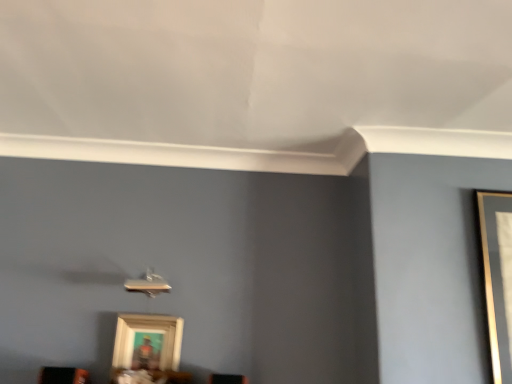
What do you see at coordinates (63, 375) in the screenshot? This screenshot has width=512, height=384. I see `matte black speaker at lower left` at bounding box center [63, 375].

Where is `matte black speaker at lower left`? matte black speaker at lower left is located at coordinates (63, 375).

This screenshot has height=384, width=512. Describe the element at coordinates (147, 349) in the screenshot. I see `wooden framed picture at lower center` at that location.

The image size is (512, 384). I want to click on wooden framed picture at lower center, so [147, 349].

The height and width of the screenshot is (384, 512). Identify the location of matte black speaker at lower left. (63, 375).

Can you confirm if matte black speaker at lower left is positioned to the right of wooden framed picture at lower center?

In fact, matte black speaker at lower left is to the left of wooden framed picture at lower center.

Considering their positions, is matte black speaker at lower left located in front of or behind wooden framed picture at lower center?

Visually, matte black speaker at lower left is located in front of wooden framed picture at lower center.

Considering the positions of point (73, 369) and point (122, 321), is point (73, 369) closer or farther from the camera than point (122, 321)?

Point (73, 369) is positioned closer to the camera compared to point (122, 321).

From the image's perspective, which object appears higher, matte black speaker at lower left or wooden framed picture at lower center?

wooden framed picture at lower center appears higher in the image.

From a real-world perspective, is matte black speaker at lower left above or below wooden framed picture at lower center?

In terms of real-world spatial position, matte black speaker at lower left is below wooden framed picture at lower center.

Looking at their sizes, would you say matte black speaker at lower left is wider or thinner than wooden framed picture at lower center?

In the image, matte black speaker at lower left appears to be wider than wooden framed picture at lower center.

Can you confirm if matte black speaker at lower left is shorter than wooden framed picture at lower center?

Yes.

Is matte black speaker at lower left smaller than wooden framed picture at lower center?

Yes, matte black speaker at lower left is smaller than wooden framed picture at lower center.

Is matte black speaker at lower left positioned beyond the bounds of wooden framed picture at lower center?

Yes, matte black speaker at lower left is outside of wooden framed picture at lower center.

Is matte black speaker at lower left not near wooden framed picture at lower center?

No, matte black speaker at lower left is not far away from wooden framed picture at lower center.

Is matte black speaker at lower left looking in the opposite direction of wooden framed picture at lower center?

matte black speaker at lower left is not turned away from wooden framed picture at lower center.

In order to click on picture frame above the matte black speaker at lower left (from a real-world perspective) in this screenshot , I will do `click(147, 349)`.

Would you say wooden framed picture at lower center is to the left or to the right of matte black speaker at lower left in the picture?

Based on their positions, wooden framed picture at lower center is located to the right of matte black speaker at lower left.

Is wooden framed picture at lower center further to the viewer compared to matte black speaker at lower left?

Yes, it is.

Is point (146, 346) positioned before point (68, 382)?

That is False.

From the image's perspective, is wooden framed picture at lower center positioned above or below matte black speaker at lower left?

From the image's perspective, wooden framed picture at lower center appears above matte black speaker at lower left.

From a real-world perspective, which object stands above the other?

In real-world perspective, wooden framed picture at lower center is above.

Considering the relative sizes of wooden framed picture at lower center and matte black speaker at lower left in the image provided, is wooden framed picture at lower center wider than matte black speaker at lower left?

Incorrect, the width of wooden framed picture at lower center does not surpass that of matte black speaker at lower left.

From their relative heights in the image, would you say wooden framed picture at lower center is taller or shorter than matte black speaker at lower left?

wooden framed picture at lower center is taller than matte black speaker at lower left.

Which of these two, wooden framed picture at lower center or matte black speaker at lower left, is bigger?

wooden framed picture at lower center is bigger.

Which is correct: wooden framed picture at lower center is inside matte black speaker at lower left, or outside of it?

wooden framed picture at lower center is not enclosed by matte black speaker at lower left.

Consider the image. Is wooden framed picture at lower center placed right next to matte black speaker at lower left?

No, wooden framed picture at lower center is not in contact with matte black speaker at lower left.

Could you tell me if wooden framed picture at lower center is turned towards matte black speaker at lower left?

No, wooden framed picture at lower center is not turned towards matte black speaker at lower left.

Can you tell me how much wooden framed picture at lower center and matte black speaker at lower left differ in facing direction?

The facing directions of wooden framed picture at lower center and matte black speaker at lower left are 3.64 degrees apart.

How far apart are wooden framed picture at lower center and matte black speaker at lower left?

wooden framed picture at lower center is 27.28 centimeters away from matte black speaker at lower left.

Identify the location of furniture lying in front of the wooden framed picture at lower center. This screenshot has height=384, width=512. pos(63,375).

Identify the location of picture frame on the right of matte black speaker at lower left. The width and height of the screenshot is (512, 384). (147, 349).

Identify the location of picture frame behind the matte black speaker at lower left. (147, 349).